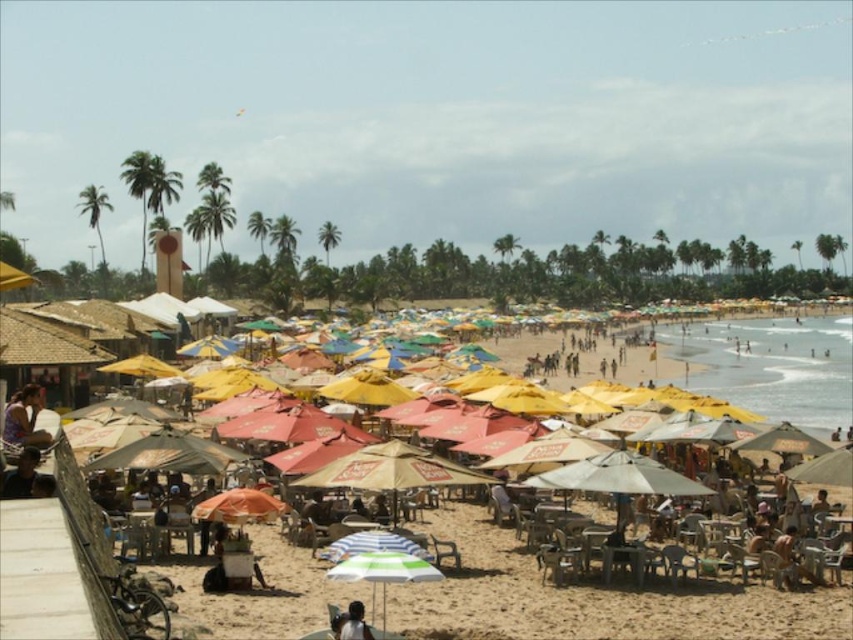
Question: Is matte black shirt at lower left to the right of wooden chair at center from the viewer's perspective?

Choices:
 (A) no
 (B) yes

Answer: (A)

Question: Considering the real-world distances, which object is farthest from the matte black shirt at lower left?

Choices:
 (A) wooden chair at center
 (B) green leafy palm tree at center

Answer: (B)

Question: Which point is farther to the camera?

Choices:
 (A) (328, 244)
 (B) (354, 604)

Answer: (A)

Question: Does matte black shirt at lower left have a smaller size compared to green leafy palm tree at center?

Choices:
 (A) no
 (B) yes

Answer: (B)

Question: Which point appears closest to the camera in this image?

Choices:
 (A) (x=9, y=404)
 (B) (x=344, y=621)
 (C) (x=527, y=625)
 (D) (x=53, y=486)

Answer: (D)

Question: Is the position of green leafy palm tree at upper left less distant than that of dark brown leather bag at lower center?

Choices:
 (A) yes
 (B) no

Answer: (B)